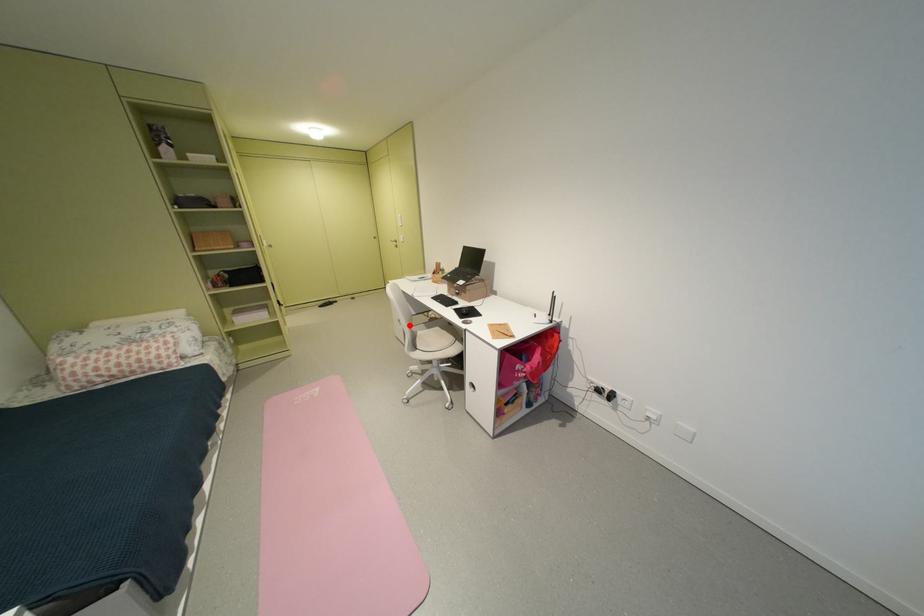
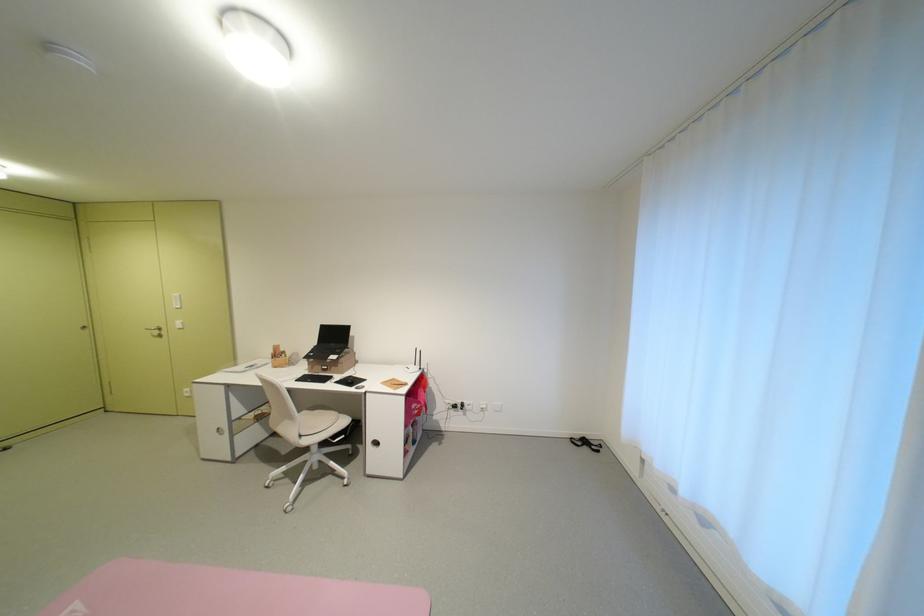
In the second image, find the point that corresponds to the highlighted location in the first image.

(232, 435)